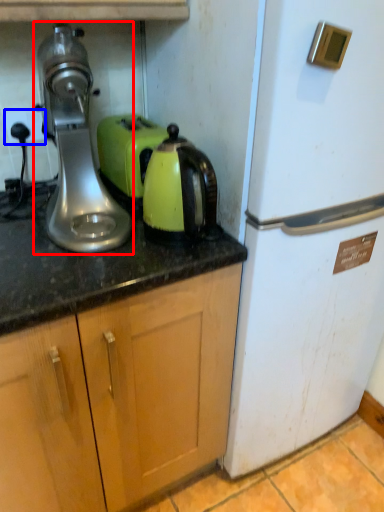
Question: Among these objects, which one is nearest to the camera, home appliance (highlighted by a red box) or electric outlet (highlighted by a blue box)?

Choices:
 (A) home appliance
 (B) electric outlet

Answer: (A)